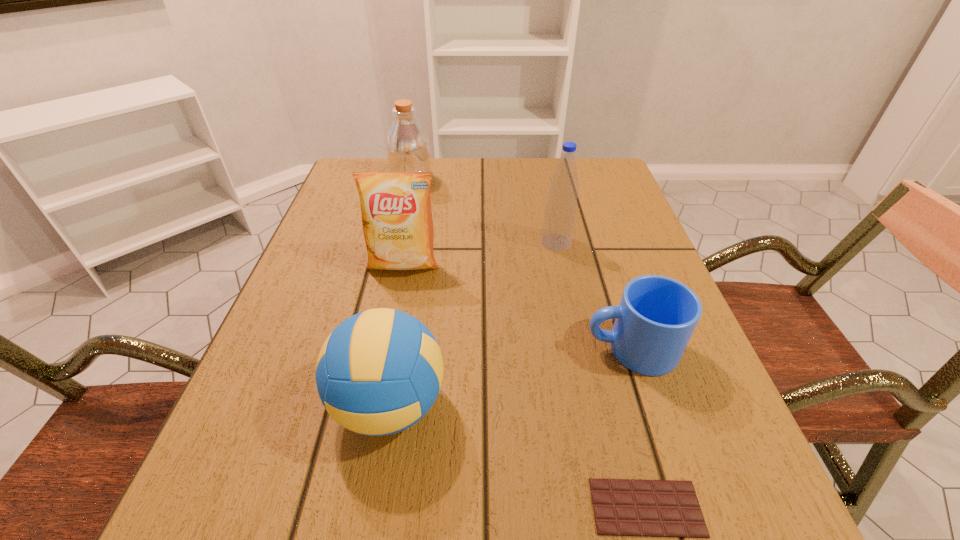
At what (x,y) coordinates should I click in order to perform the action: click on free space between the crisp (potato chip) and the chocolate bar. Please return your answer as a coordinate pair (x, y). The image size is (960, 540). Looking at the image, I should click on (525, 386).

Locate an element on the screen. vacant space that's between the bottle and the water bottle is located at coordinates (484, 211).

Image resolution: width=960 pixels, height=540 pixels. In order to click on free space between the nearest object and the crisp (potato chip) in this screenshot , I will do `click(525, 386)`.

Where is `blank region between the crisp (potato chip) and the water bottle`? Image resolution: width=960 pixels, height=540 pixels. blank region between the crisp (potato chip) and the water bottle is located at coordinates (480, 253).

In order to click on vacant area that lies between the bottle and the water bottle in this screenshot , I will do `click(484, 211)`.

Locate an element on the screen. Image resolution: width=960 pixels, height=540 pixels. vacant area that lies between the water bottle and the fifth tallest object is located at coordinates (x=593, y=295).

You are a GUI agent. You are given a task and a screenshot of the screen. Output one action in this format:
    pyautogui.click(x=<x>, y=<y>)
    Task: Click on the empty space between the water bottle and the farthest object
    
    Given the screenshot: What is the action you would take?
    pyautogui.click(x=484, y=211)

Find the location of a particular element. free space between the water bottle and the farthest object is located at coordinates (484, 211).

Where is `vacant area that lies between the nearest object and the fourth tallest object`? The image size is (960, 540). vacant area that lies between the nearest object and the fourth tallest object is located at coordinates (517, 456).

The image size is (960, 540). What are the coordinates of `free spot between the water bottle and the fifth tallest object` in the screenshot? It's located at (593, 295).